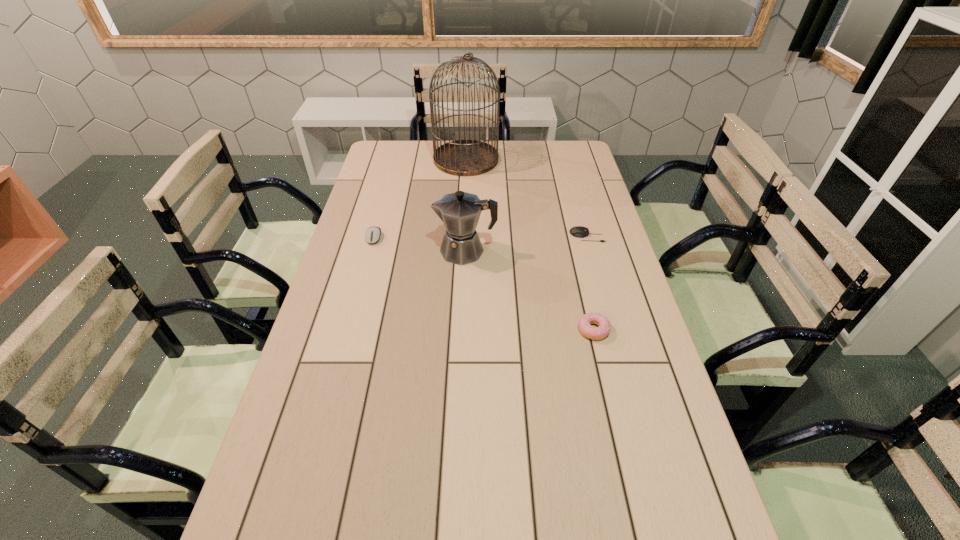
Locate which object ranks in proximity to the coffeepot. Please provide its 2D coordinates. Your answer should be formatted as a tuple, i.e. [(x, y)], where the tuple contains the x and y coordinates of a point satisfying the conditions above.

[(372, 235)]

Find the location of a particular element. the fourth closest object to the tallest object is located at coordinates point(595,333).